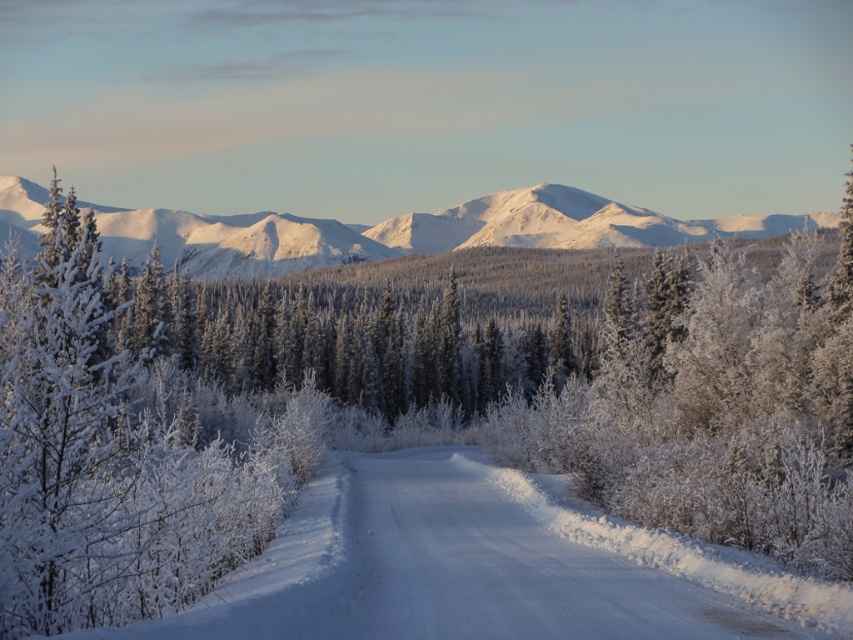
You are a photographer planning to take a photo of the white frosty tree at upper left and the white fluffy snow at center. You want to ensure both are in focus. If your camera has a depth of field that can cover 10 meters, will both objects be in focus?

The distance between the white frosty tree at upper left and white fluffy snow at center is 9.90 meters, which is within the camera depth of field of 10 meters. Therefore, both objects will be in focus.